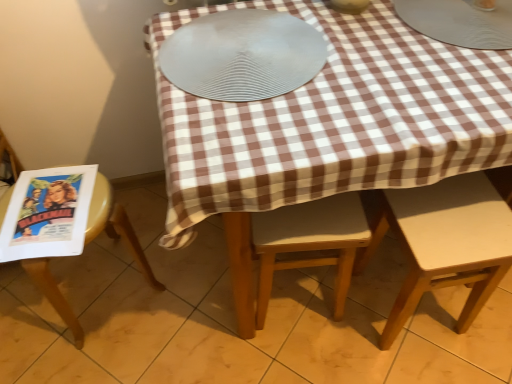
Identify the location of free space below yellow plastic chair at left, marked as the 3th chair in a right-to-left arrangement (from a real-world perspective). The image size is (512, 384). (100, 293).